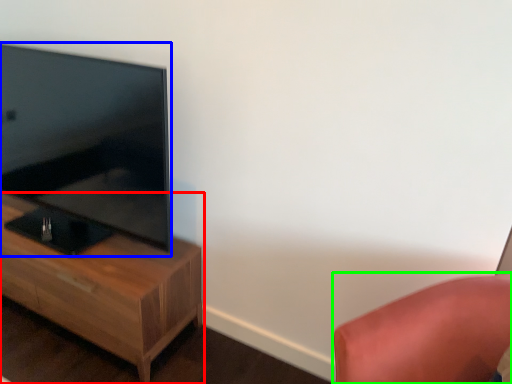
Question: Which is farther away from nightstand (highlighted by a red box)? television (highlighted by a blue box) or furniture (highlighted by a green box)?

Choices:
 (A) television
 (B) furniture

Answer: (B)